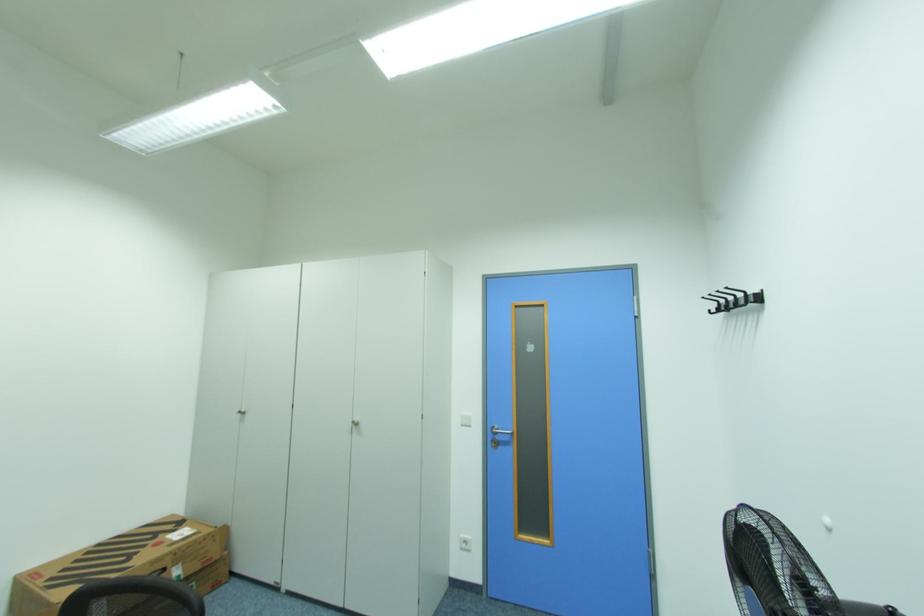
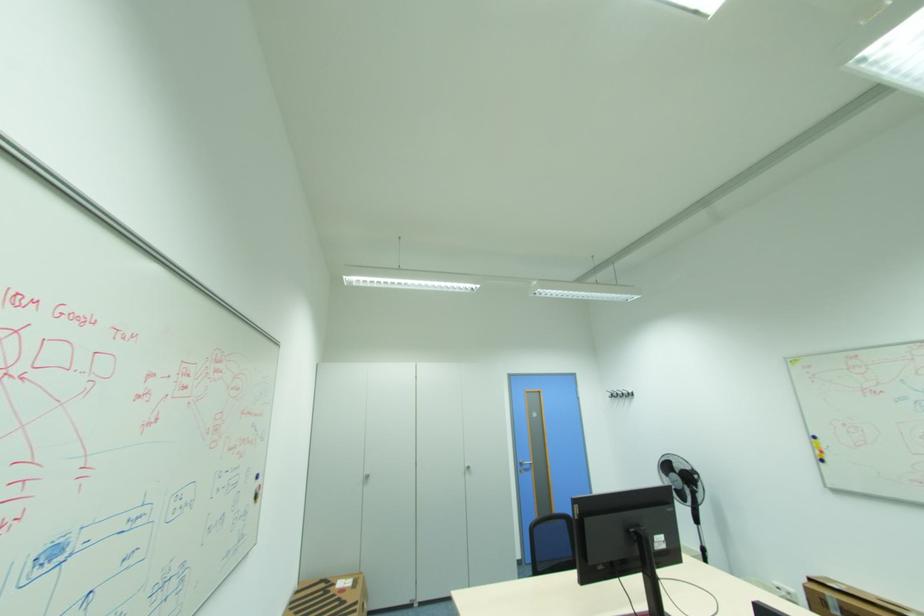
The point at (178, 531) is marked in the first image. Where is the corresponding point in the second image?

(338, 585)